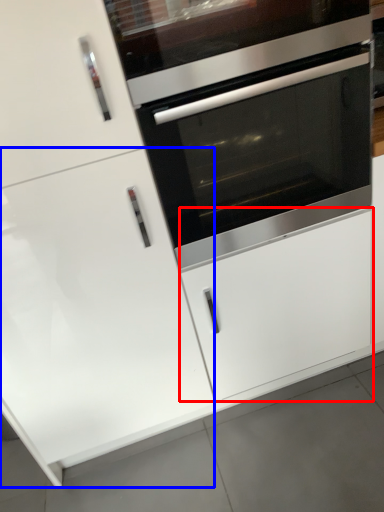
Question: Which point is further to the camera, drawer (highlighted by a red box) or door (highlighted by a blue box)?

Choices:
 (A) drawer
 (B) door

Answer: (A)